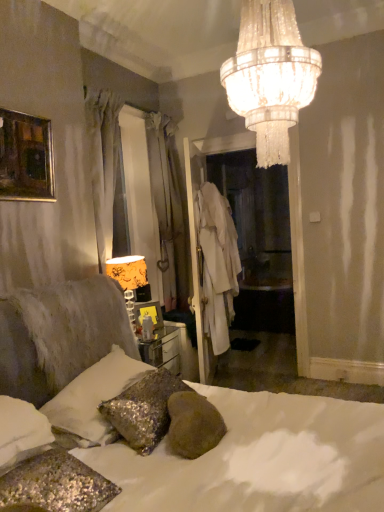
Question: Can you confirm if white sequined pillow at lower left is bigger than white cotton robe at center?

Choices:
 (A) no
 (B) yes

Answer: (B)

Question: From a real-world perspective, is white sequined pillow at lower left beneath white cotton robe at center?

Choices:
 (A) no
 (B) yes

Answer: (B)

Question: Does white sequined pillow at lower left have a greater height compared to white cotton robe at center?

Choices:
 (A) no
 (B) yes

Answer: (A)

Question: Is white sequined pillow at lower left beside white cotton robe at center?

Choices:
 (A) no
 (B) yes

Answer: (A)

Question: Does white sequined pillow at lower left have a smaller size compared to white cotton robe at center?

Choices:
 (A) no
 (B) yes

Answer: (A)

Question: From the image's perspective, is white sequined pillow at lower left under white cotton robe at center?

Choices:
 (A) yes
 (B) no

Answer: (A)

Question: From the image's perspective, would you say white cotton robe at center is shown under sparkly silver pillow at lower left, which is the 2th pillow from front to back?

Choices:
 (A) no
 (B) yes

Answer: (A)

Question: Is white cotton robe at center looking in the opposite direction of sparkly silver pillow at lower left, which is the 2th pillow from front to back?

Choices:
 (A) no
 (B) yes

Answer: (A)

Question: From a real-world perspective, does white cotton robe at center stand above sparkly silver pillow at lower left, which is the 2th pillow from front to back?

Choices:
 (A) no
 (B) yes

Answer: (B)

Question: Is white cotton robe at center facing towards sparkly silver pillow at lower left, which is the 2th pillow from front to back?

Choices:
 (A) yes
 (B) no

Answer: (B)

Question: Can you confirm if white cotton robe at center is smaller than sparkly silver pillow at lower left, which is the 2th pillow from front to back?

Choices:
 (A) no
 (B) yes

Answer: (A)

Question: Can you confirm if white cotton robe at center is wider than sparkly silver pillow at lower left, the second pillow positioned from the back?

Choices:
 (A) yes
 (B) no

Answer: (B)

Question: Considering the relative sizes of crystal chandelier at upper center and white sequined pillow at lower left, which ranks as the 3th pillow in front-to-back order, in the image provided, is crystal chandelier at upper center wider than white sequined pillow at lower left, which ranks as the 3th pillow in front-to-back order,?

Choices:
 (A) yes
 (B) no

Answer: (A)